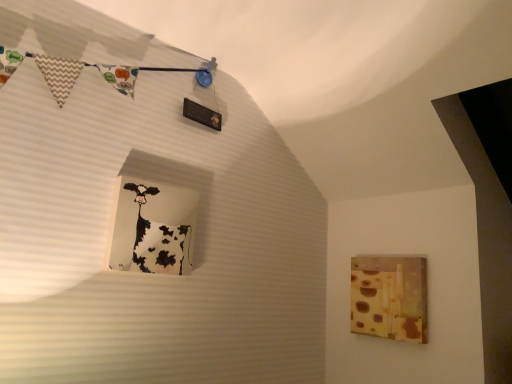
Locate an element on the screen. This screenshot has width=512, height=384. matte yellow cheese at right is located at coordinates (389, 297).

Image resolution: width=512 pixels, height=384 pixels. Describe the element at coordinates (389, 297) in the screenshot. I see `matte yellow cheese at right` at that location.

Where is `white glossy cow at upper left`? white glossy cow at upper left is located at coordinates (161, 233).

In order to face white glossy cow at upper left, should I rotate leftwards or rightwards?

Turn left by 13.135 degrees to look at white glossy cow at upper left.

The image size is (512, 384). What do you see at coordinates (161, 233) in the screenshot?
I see `white glossy cow at upper left` at bounding box center [161, 233].

The width and height of the screenshot is (512, 384). Find the location of `matte yellow cheese at right`. matte yellow cheese at right is located at coordinates (389, 297).

Can you confirm if white glossy cow at upper left is positioned to the right of matte yellow cheese at right?

In fact, white glossy cow at upper left is to the left of matte yellow cheese at right.

Which object is further away from the camera taking this photo, white glossy cow at upper left or matte yellow cheese at right?

Positioned behind is matte yellow cheese at right.

Considering the positions of point (165, 243) and point (373, 300), is point (165, 243) closer or farther from the camera than point (373, 300)?

Point (165, 243) appears to be closer to the viewer than point (373, 300).

From the image's perspective, is white glossy cow at upper left on top of matte yellow cheese at right?

Yes, from the image's perspective, white glossy cow at upper left is on top of matte yellow cheese at right.

From a real-world perspective, which object stands above the other?

white glossy cow at upper left, from a real-world perspective.

Can you confirm if white glossy cow at upper left is wider than matte yellow cheese at right?

Indeed, white glossy cow at upper left has a greater width compared to matte yellow cheese at right.

Does white glossy cow at upper left have a greater height compared to matte yellow cheese at right?

Incorrect, the height of white glossy cow at upper left is not larger of that of matte yellow cheese at right.

Is white glossy cow at upper left smaller than matte yellow cheese at right?

Yes.

Is white glossy cow at upper left located outside matte yellow cheese at right?

Yes, white glossy cow at upper left is outside of matte yellow cheese at right.

Is white glossy cow at upper left next to matte yellow cheese at right?

white glossy cow at upper left and matte yellow cheese at right are not in contact.

Is white glossy cow at upper left oriented away from matte yellow cheese at right?

No.

How different are the orientations of white glossy cow at upper left and matte yellow cheese at right in degrees?

white glossy cow at upper left and matte yellow cheese at right are facing 89.9 degrees away from each other.

Find the location of a particular element. This screenshot has width=512, height=384. picture frame below the white glossy cow at upper left (from a real-world perspective) is located at coordinates (389, 297).

Can you confirm if matte yellow cheese at right is positioned to the left of white glossy cow at upper left?

In fact, matte yellow cheese at right is to the right of white glossy cow at upper left.

Which object is further away from the camera, matte yellow cheese at right or white glossy cow at upper left?

matte yellow cheese at right is further from the camera.

Is point (380, 294) positioned behind point (149, 187)?

Yes, it is.

From the image's perspective, does matte yellow cheese at right appear higher than white glossy cow at upper left?

No, from the image's perspective, matte yellow cheese at right is not over white glossy cow at upper left.

From a real-world perspective, is matte yellow cheese at right below white glossy cow at upper left?

Indeed, from a real-world perspective, matte yellow cheese at right is positioned beneath white glossy cow at upper left.

Between matte yellow cheese at right and white glossy cow at upper left, which one has larger width?

Wider between the two is white glossy cow at upper left.

Considering the sizes of objects matte yellow cheese at right and white glossy cow at upper left in the image provided, who is taller, matte yellow cheese at right or white glossy cow at upper left?

matte yellow cheese at right.

Looking at the image, does matte yellow cheese at right seem bigger or smaller compared to white glossy cow at upper left?

matte yellow cheese at right is bigger than white glossy cow at upper left.

Do you think matte yellow cheese at right is within white glossy cow at upper left, or outside of it?

matte yellow cheese at right lies outside white glossy cow at upper left.

Are matte yellow cheese at right and white glossy cow at upper left beside each other?

No, matte yellow cheese at right is not next to white glossy cow at upper left.

Is matte yellow cheese at right aimed at white glossy cow at upper left?

Yes, matte yellow cheese at right is turned towards white glossy cow at upper left.

Where is `art above the matte yellow cheese at right (from the image's perspective)`? This screenshot has width=512, height=384. art above the matte yellow cheese at right (from the image's perspective) is located at coordinates (161, 233).

In order to click on picture frame below the white glossy cow at upper left (from the image's perspective) in this screenshot , I will do `click(389, 297)`.

Identify the location of picture frame below the white glossy cow at upper left (from a real-world perspective). Image resolution: width=512 pixels, height=384 pixels. (389, 297).